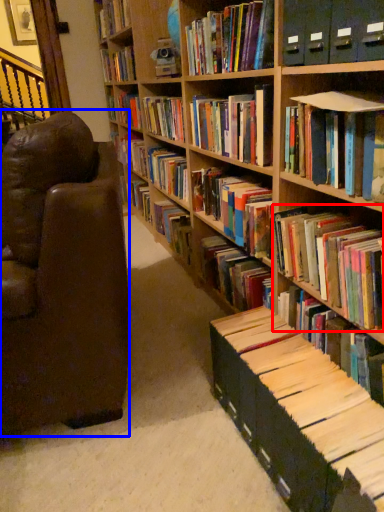
Question: Which point is closer to the camera, book (highlighted by a red box) or chair (highlighted by a blue box)?

Choices:
 (A) book
 (B) chair

Answer: (A)